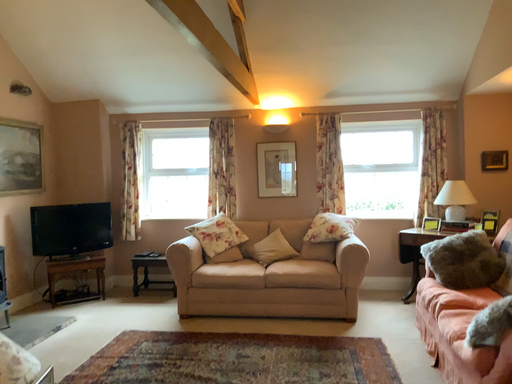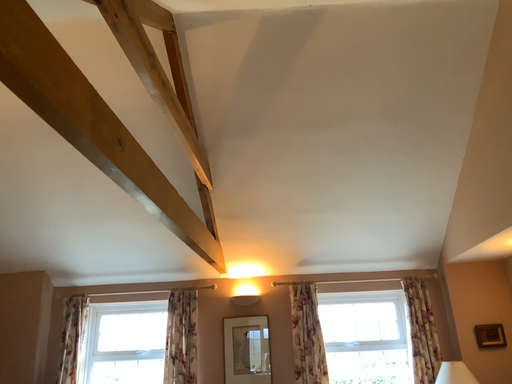
Question: Which way did the camera rotate in the video?

Choices:
 (A) rotated downward
 (B) rotated upward

Answer: (B)